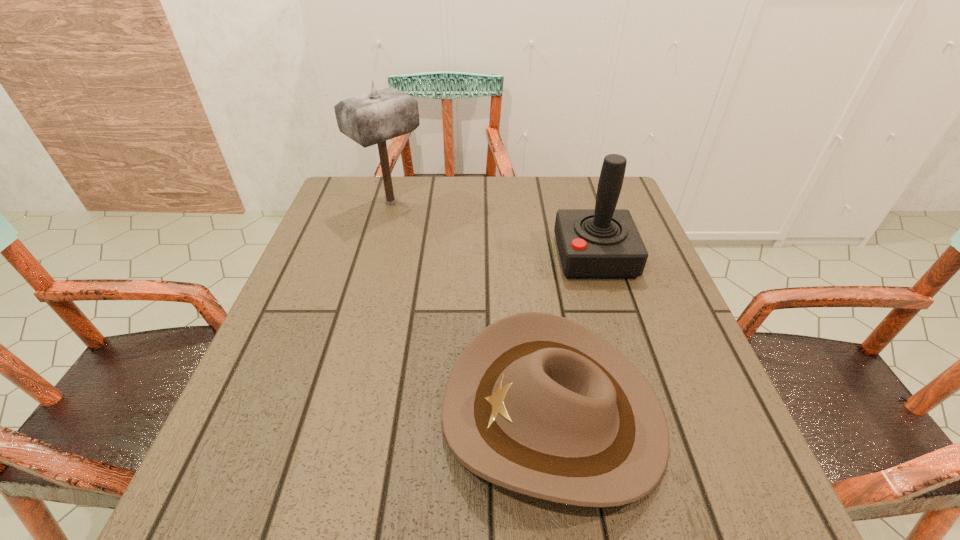
At what (x,y) coordinates should I click in order to perform the action: click on the farthest object. Please return your answer as a coordinate pair (x, y). Looking at the image, I should click on (373, 118).

Identify the location of the tallest object. This screenshot has height=540, width=960. (373, 118).

Locate an element on the screen. The width and height of the screenshot is (960, 540). the second tallest object is located at coordinates (604, 242).

Find the location of a particular element. the second farthest object is located at coordinates (604, 242).

Find the location of `cowboy hat`. cowboy hat is located at coordinates (538, 404).

Identify the location of the shortest object. The height and width of the screenshot is (540, 960). (538, 404).

Where is `vacant space located on the right of the leftmost object`? The width and height of the screenshot is (960, 540). vacant space located on the right of the leftmost object is located at coordinates (517, 202).

The width and height of the screenshot is (960, 540). In order to click on vacant area situated on the base of the joystick in this screenshot , I will do `click(486, 256)`.

This screenshot has height=540, width=960. I want to click on vacant space situated on the base of the joystick, so click(x=523, y=256).

This screenshot has width=960, height=540. Identify the location of vacant space located 0.220m on the base of the joystick. (465, 256).